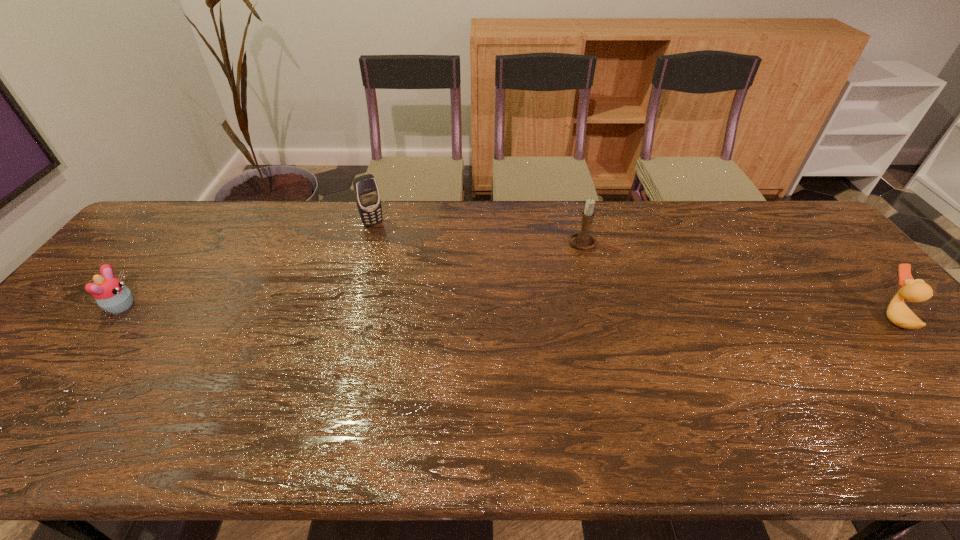
Locate an element on the screen. The height and width of the screenshot is (540, 960). the leftmost object is located at coordinates (111, 294).

At what (x,y) coordinates should I click in order to perform the action: click on duck. Please return your answer as a coordinate pair (x, y). Looking at the image, I should click on (898, 312).

Locate an element on the screen. The height and width of the screenshot is (540, 960). the second farthest object is located at coordinates (582, 239).

At what (x,y) coordinates should I click in order to perform the action: click on candle holder. Please return your answer as a coordinate pair (x, y). Looking at the image, I should click on (582, 239).

Where is `the farthest object`? the farthest object is located at coordinates (367, 196).

Locate an element on the screen. This screenshot has width=960, height=540. the third object from right to left is located at coordinates (367, 196).

Locate an element on the screen. free space located 0.050m on the face of the cupcake is located at coordinates (154, 306).

This screenshot has width=960, height=540. I want to click on vacant space located on the beak of the rightmost object, so click(746, 317).

In order to click on free spot located 0.390m on the beak of the rightmost object in this screenshot , I will do `click(731, 317)`.

The height and width of the screenshot is (540, 960). What are the coordinates of `vacant space located 0.090m on the beak of the rightmost object` in the screenshot? It's located at (846, 317).